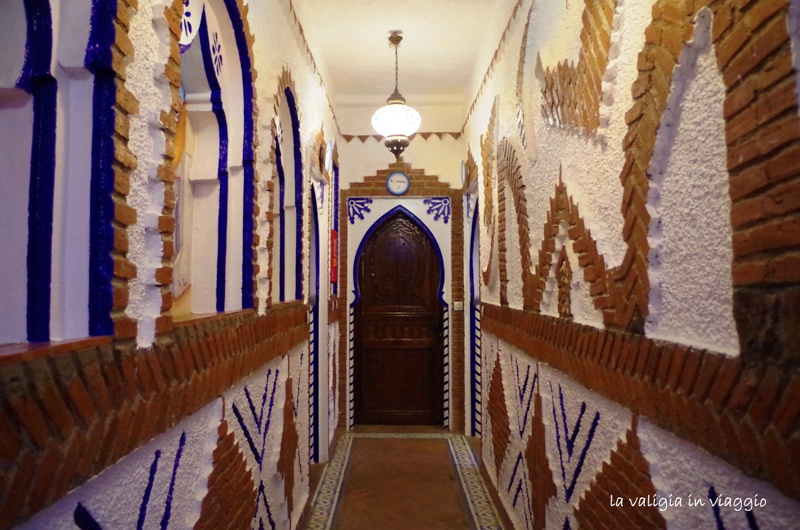
Locate an element on the screen. This screenshot has height=530, width=800. light globe is located at coordinates (398, 117).